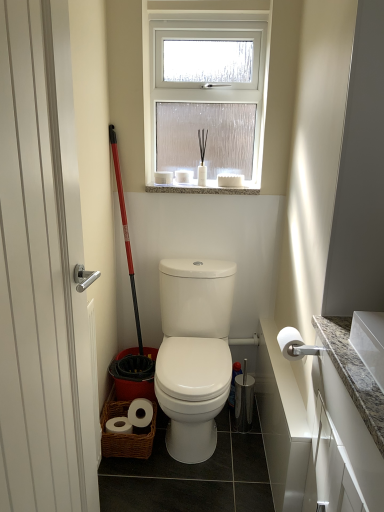
Question: Visually, is red plastic ski pole at left positioned to the left or to the right of white granite countertop at right?

Choices:
 (A) left
 (B) right

Answer: (A)

Question: Looking at the image, does red plastic ski pole at left seem bigger or smaller compared to white granite countertop at right?

Choices:
 (A) big
 (B) small

Answer: (B)

Question: Estimate the real-world distances between objects in this image. Which object is farther from the white glossy door at left?

Choices:
 (A) white granite countertop at right
 (B) white glossy toilet at center
 (C) red plastic ski pole at left
 (D) white frosted glass window at upper center
 (E) granite at upper center

Answer: (D)

Question: Based on their relative distances, which object is farther from the white matte toilet paper at right?

Choices:
 (A) red plastic ski pole at left
 (B) white granite countertop at right
 (C) granite at upper center
 (D) white glossy toilet at center
 (E) white frosted glass window at upper center

Answer: (E)